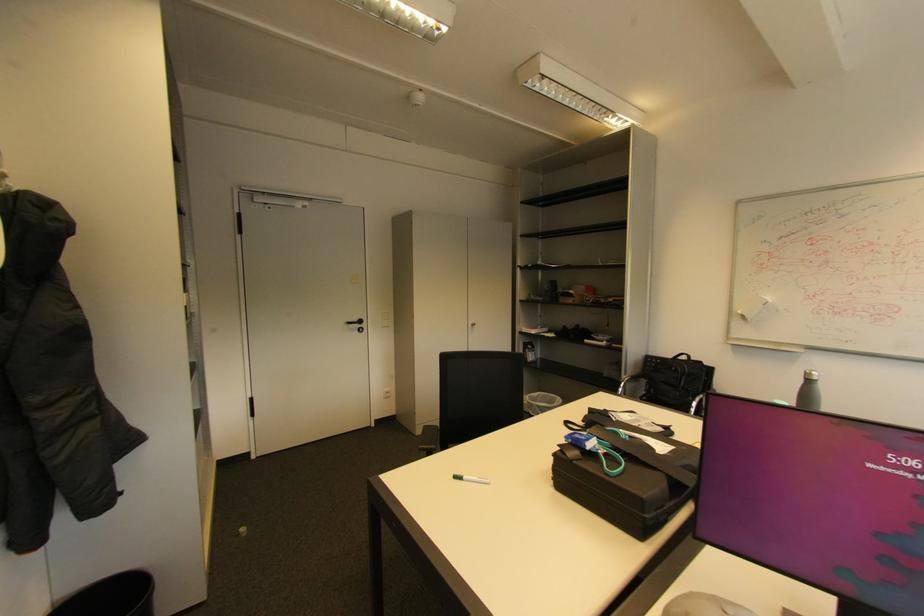
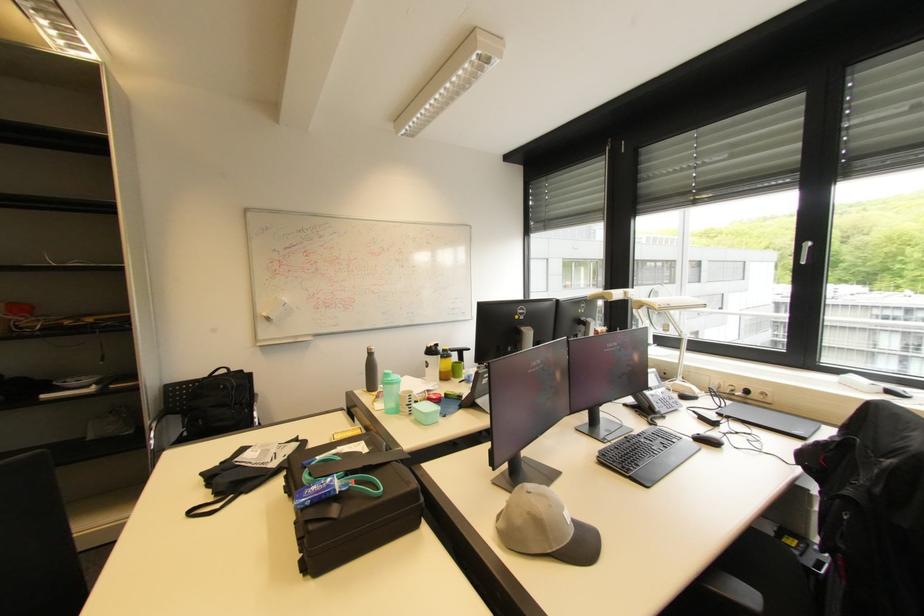
Locate, in the second image, the point that corresponds to pixel 748 318 in the first image.

(273, 320)